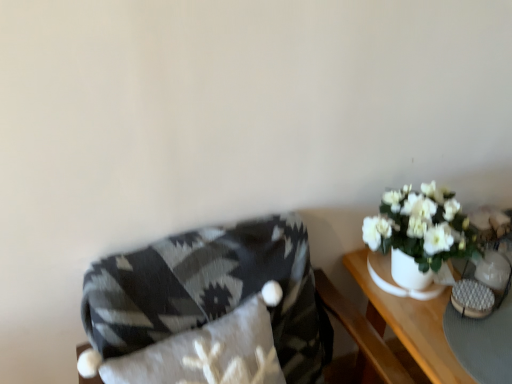
Question: Does textured gray blanket at left appear on the right side of white ceramic table at right?

Choices:
 (A) no
 (B) yes

Answer: (A)

Question: Is textured gray blanket at left taller than white ceramic table at right?

Choices:
 (A) yes
 (B) no

Answer: (A)

Question: Does textured gray blanket at left have a lesser height compared to white ceramic table at right?

Choices:
 (A) yes
 (B) no

Answer: (B)

Question: Considering the relative positions of textured gray blanket at left and white ceramic table at right in the image provided, is textured gray blanket at left to the left of white ceramic table at right from the viewer's perspective?

Choices:
 (A) no
 (B) yes

Answer: (B)

Question: Is white ceramic table at right at the back of textured gray blanket at left?

Choices:
 (A) no
 (B) yes

Answer: (A)

Question: Is white ceramic vase at right to the left or to the right of textured gray blanket at left in the image?

Choices:
 (A) right
 (B) left

Answer: (A)

Question: Is point (385, 263) positioned closer to the camera than point (288, 360)?

Choices:
 (A) farther
 (B) closer

Answer: (A)

Question: Considering the positions of white ceramic vase at right and textured gray blanket at left in the image, is white ceramic vase at right wider or thinner than textured gray blanket at left?

Choices:
 (A) wide
 (B) thin

Answer: (B)

Question: From a real-world perspective, is white ceramic vase at right above or below textured gray blanket at left?

Choices:
 (A) below
 (B) above

Answer: (B)

Question: From a real-world perspective, is white ceramic vase at right positioned above or below white ceramic table at right?

Choices:
 (A) below
 (B) above

Answer: (B)

Question: Looking at the image, does white ceramic vase at right seem bigger or smaller compared to white ceramic table at right?

Choices:
 (A) small
 (B) big

Answer: (A)

Question: Would you say white ceramic vase at right is to the left or to the right of white ceramic table at right in the picture?

Choices:
 (A) right
 (B) left

Answer: (B)

Question: In the image, is white ceramic vase at right positioned in front of or behind white ceramic table at right?

Choices:
 (A) behind
 (B) front

Answer: (A)

Question: From a real-world perspective, is textured gray blanket at left physically located above or below white ceramic vase at right?

Choices:
 (A) above
 (B) below

Answer: (B)

Question: In the image, is textured gray blanket at left positioned in front of or behind white ceramic vase at right?

Choices:
 (A) behind
 (B) front

Answer: (B)